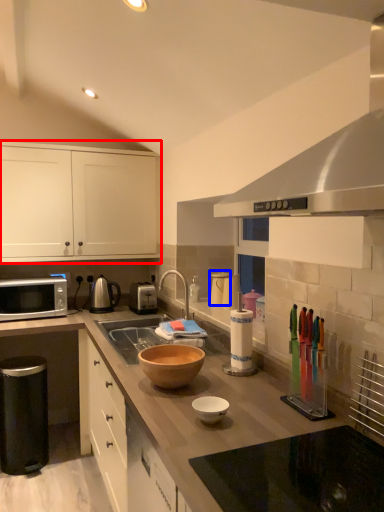
Question: Which point is closer to the camera, cabinetry (highlighted by a red box) or appliance (highlighted by a blue box)?

Choices:
 (A) cabinetry
 (B) appliance

Answer: (B)